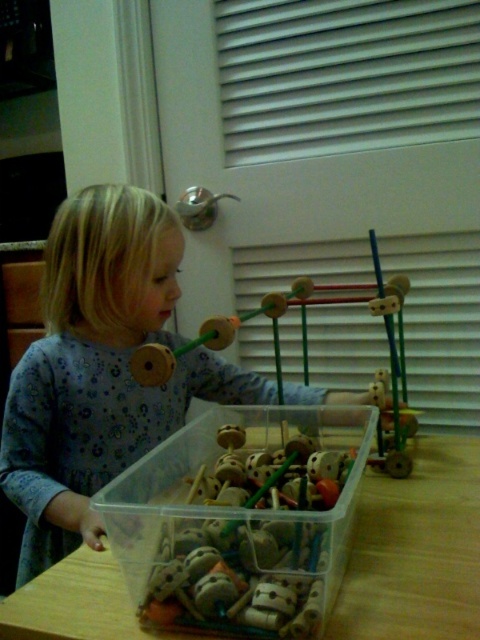
Who is higher up, wooden beads at center or wooden toy at center?

wooden toy at center is higher up.

Is point (324, 586) positioned after point (372, 403)?

No, it is in front of (372, 403).

Identify the location of wooden beads at center. (253, 528).

This screenshot has width=480, height=640. In order to click on wooden beads at center in this screenshot , I will do `click(253, 528)`.

Which of these two, blue fabric dress at center or wooden table at lower center, stands taller?

Standing taller between the two is blue fabric dress at center.

Identify the location of blue fabric dress at center. This screenshot has height=640, width=480. (100, 369).

What are the coordinates of `blue fabric dress at center` in the screenshot? It's located at [x=100, y=369].

Between point (120, 260) and point (262, 582), which one is positioned in front?

Point (262, 582) is more forward.

Who is more forward, (92,284) or (309,628)?

Positioned in front is point (309,628).

Where is `blue fabric dress at center`? The image size is (480, 640). blue fabric dress at center is located at coordinates (100, 369).